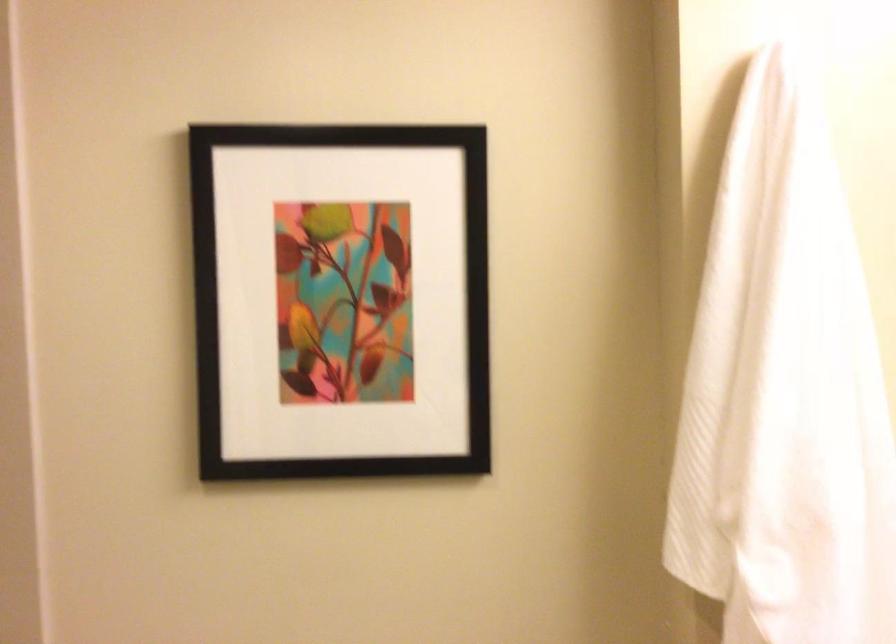
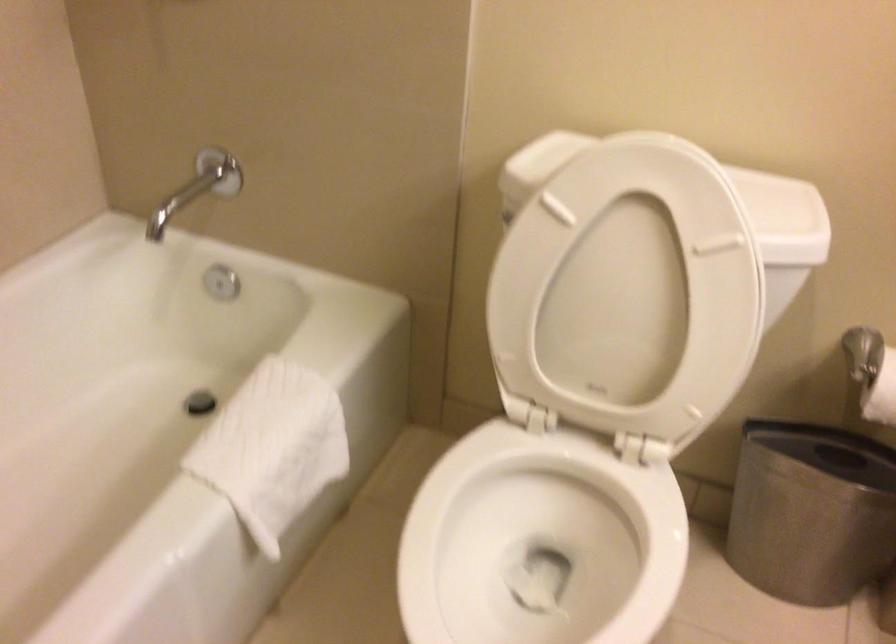
The images are taken continuously from a first-person perspective. In which direction is your viewpoint rotating?

The camera rotated toward left-down.